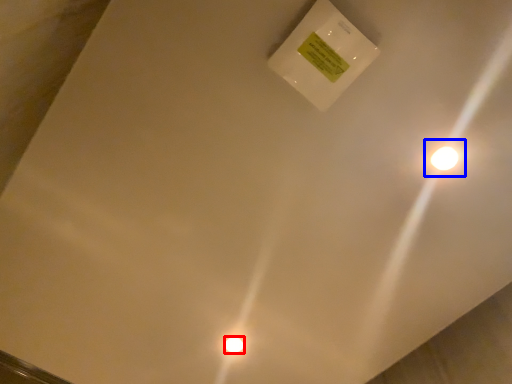
Question: Among these objects, which one is farthest to the camera, light bulb (highlighted by a red box) or light (highlighted by a blue box)?

Choices:
 (A) light bulb
 (B) light

Answer: (A)